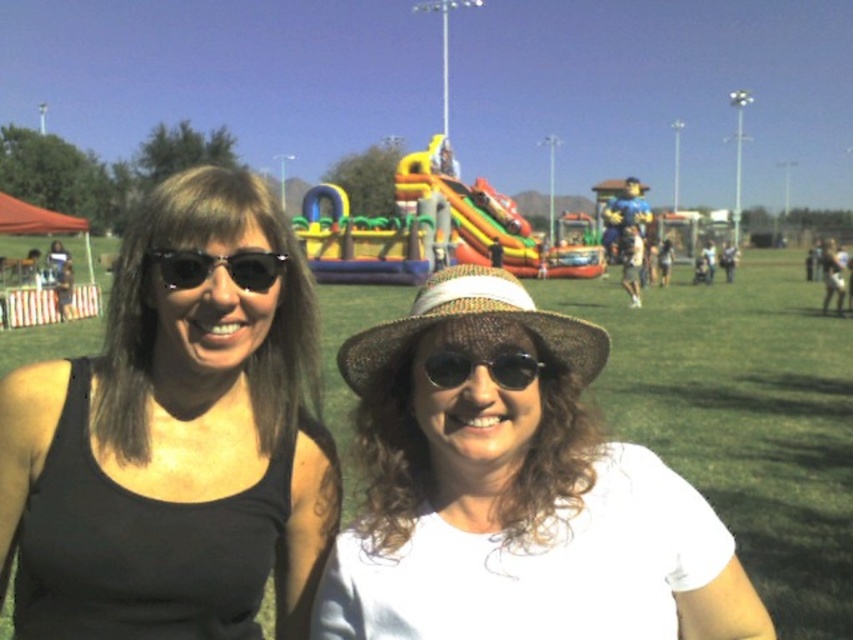
You are a photographer trying to capture a photo of the two individuals while ensuring the brown woven hat at center is visible in the frame. Based on its coordinates, where should you position the camera relative to the subjects to include the hat?

The brown woven hat at center is located at point coordinates, so positioning the camera slightly to the left of the subjects would ensure the hat remains in the frame.

You are a photographer trying to capture a closeup shot of the black reflective sunglasses at left and the black reflective sunglasses at center. Since both are reflective, you need to position your camera so that the sunlight reflects off both pairs of sunglasses into your lens. Given their positions, which sunglasses should you position your camera closer to in order to capture the reflection from both?

You should position your camera closer to the black reflective sunglasses at left because it is to the left of the black reflective sunglasses at center, allowing the sunlight to reflect off both pairs when the camera is angled appropriately.

You are a photographer trying to capture both the black reflective sunglasses at left and the black reflective sunglasses at center in a single frame. Based on their positions, which sunglasses are positioned higher in the image?

The black reflective sunglasses at left are positioned higher in the image than the black reflective sunglasses at center, as they are located above them.